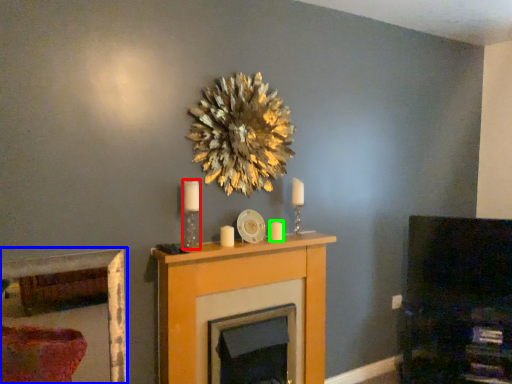
Question: Considering the real-world distances, which object is farthest from candle holder (highlighted by a red box)? picture frame (highlighted by a blue box) or candle (highlighted by a green box)?

Choices:
 (A) picture frame
 (B) candle

Answer: (A)